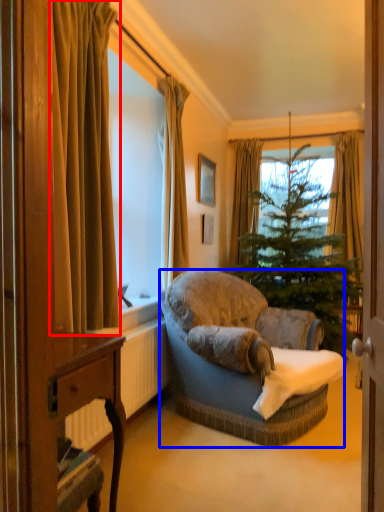
Question: Which object is closer to the camera taking this photo, curtain (highlighted by a red box) or studio couch (highlighted by a blue box)?

Choices:
 (A) curtain
 (B) studio couch

Answer: (A)